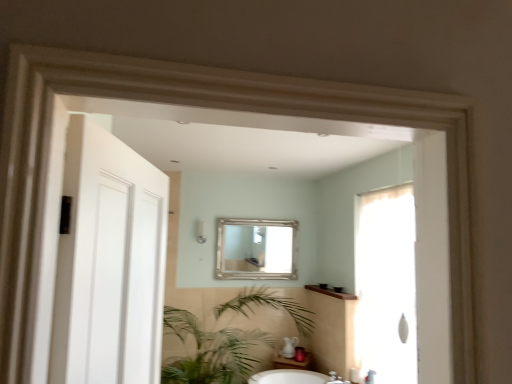
Question: Can you confirm if white matte door at left is thinner than green leafy plant at lower center?

Choices:
 (A) no
 (B) yes

Answer: (B)

Question: Is white matte door at left facing towards green leafy plant at lower center?

Choices:
 (A) yes
 (B) no

Answer: (B)

Question: Could green leafy plant at lower center be considered to be inside white matte door at left?

Choices:
 (A) no
 (B) yes

Answer: (A)

Question: From a real-world perspective, is white matte door at left below green leafy plant at lower center?

Choices:
 (A) no
 (B) yes

Answer: (A)

Question: From the image's perspective, is white matte door at left located above green leafy plant at lower center?

Choices:
 (A) yes
 (B) no

Answer: (A)

Question: Is white matte door at left facing away from green leafy plant at lower center?

Choices:
 (A) no
 (B) yes

Answer: (A)

Question: Does white matte door at left have a lesser width compared to translucent fabric screen door at right?

Choices:
 (A) yes
 (B) no

Answer: (A)

Question: From the image's perspective, is white matte door at left under translucent fabric screen door at right?

Choices:
 (A) yes
 (B) no

Answer: (B)

Question: Are white matte door at left and translucent fabric screen door at right beside each other?

Choices:
 (A) yes
 (B) no

Answer: (B)

Question: Is white matte door at left shorter than translucent fabric screen door at right?

Choices:
 (A) yes
 (B) no

Answer: (A)

Question: Is white matte door at left positioned beyond the bounds of translucent fabric screen door at right?

Choices:
 (A) no
 (B) yes

Answer: (B)

Question: From a real-world perspective, is white matte door at left on translucent fabric screen door at right?

Choices:
 (A) yes
 (B) no

Answer: (A)

Question: Is silver metallic mirror at center taller than white matte door at left?

Choices:
 (A) yes
 (B) no

Answer: (B)